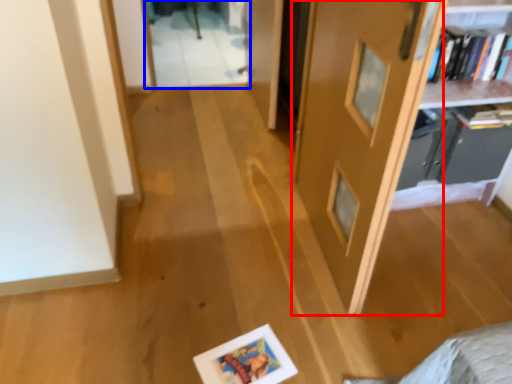
Question: Which point is further to the camera, door (highlighted by a red box) or glass door (highlighted by a blue box)?

Choices:
 (A) door
 (B) glass door

Answer: (B)